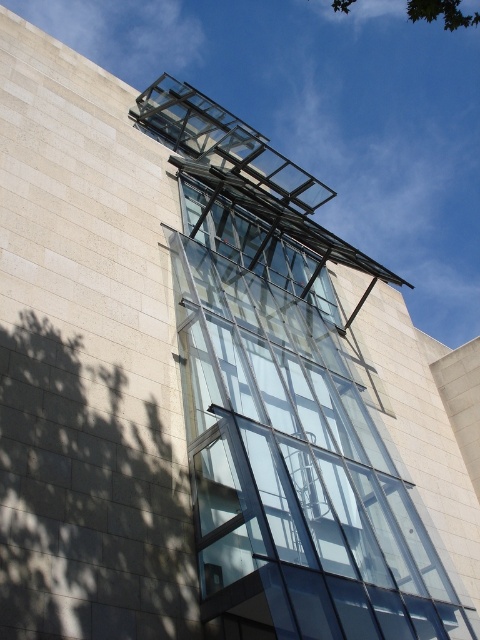
Does transparent glass elevator at center appear over green leafy tree at upper center?

Incorrect, transparent glass elevator at center is not positioned above green leafy tree at upper center.

Which is in front, point (269, 509) or point (340, 3)?

Point (269, 509)

I want to click on transparent glass elevator at center, so click(x=295, y=458).